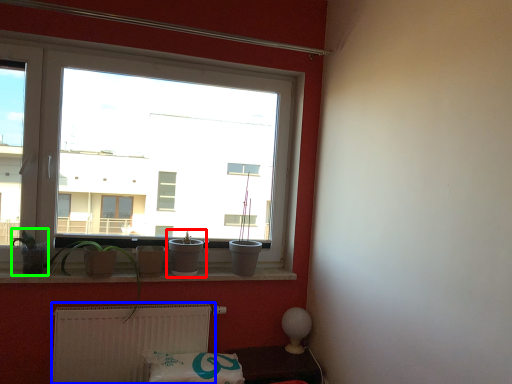
Question: Which object is positioned farthest from houseplant (highlighted by a red box)? Select from radiator (highlighted by a blue box) and plant (highlighted by a green box).

Choices:
 (A) radiator
 (B) plant

Answer: (B)